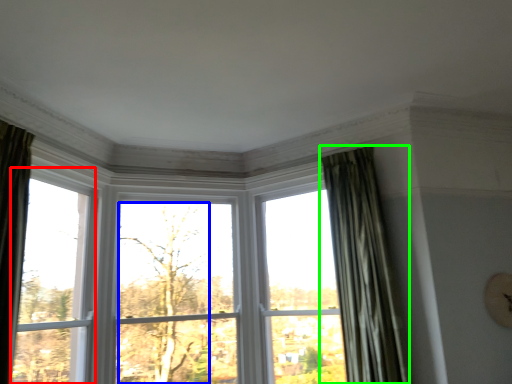
Question: Based on their relative distances, which object is nearer to window (highlighted by a red box)? Choose from tree (highlighted by a blue box) and curtain (highlighted by a green box).

Choices:
 (A) tree
 (B) curtain

Answer: (A)